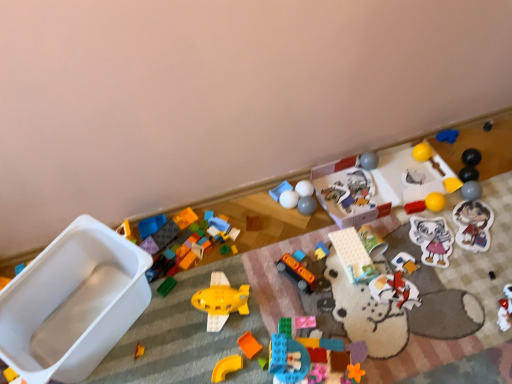
Locate an element on the screen. This screenshot has width=512, height=384. free space between pink matte block at center, acting as the 14th toy starting from the right, and matte gray ball at right, the 2th toy from the right is located at coordinates (389, 259).